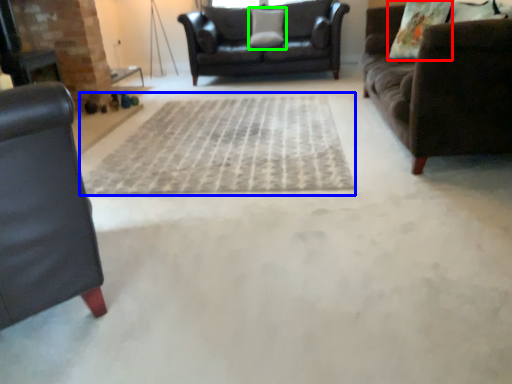
Question: Considering the real-world distances, which object is farthest from pillow (highlighted by a red box)? doormat (highlighted by a blue box) or pillow (highlighted by a green box)?

Choices:
 (A) doormat
 (B) pillow

Answer: (B)